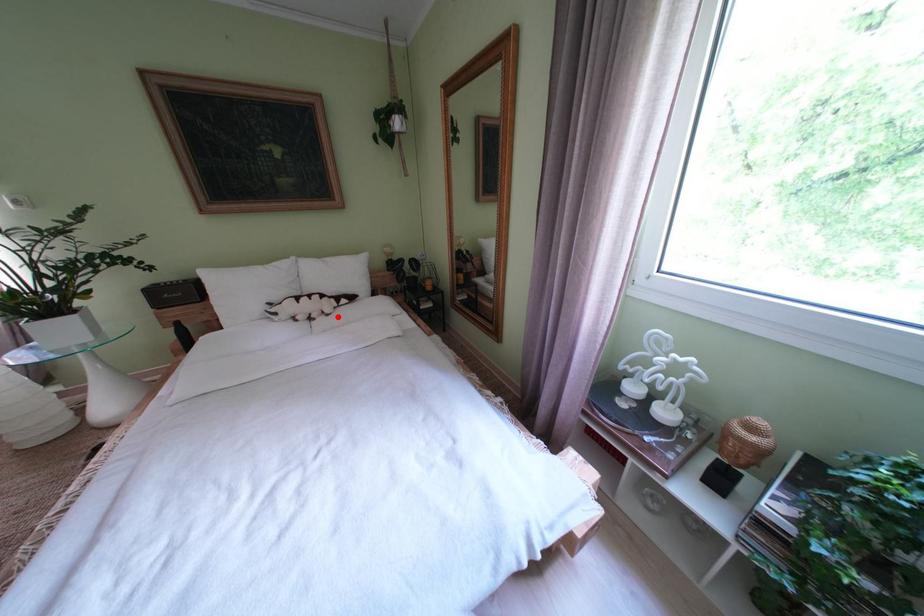
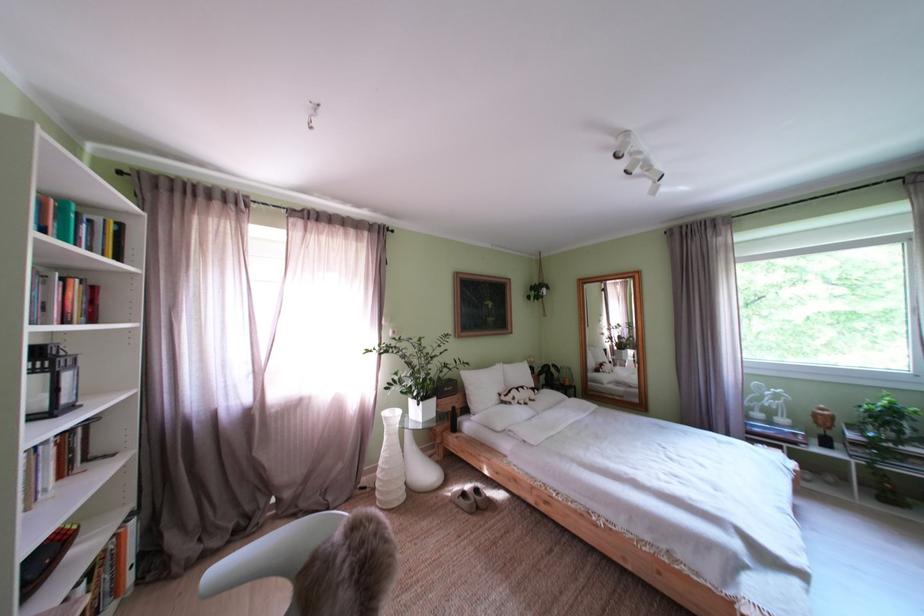
Question: A red point is marked in image1. In image2, is the corresponding 3D point closer to the camera or farther? Reply with the corresponding letter.

Choices:
 (A) The corresponding 3D point is closer.
 (B) The corresponding 3D point is farther.

Answer: (B)